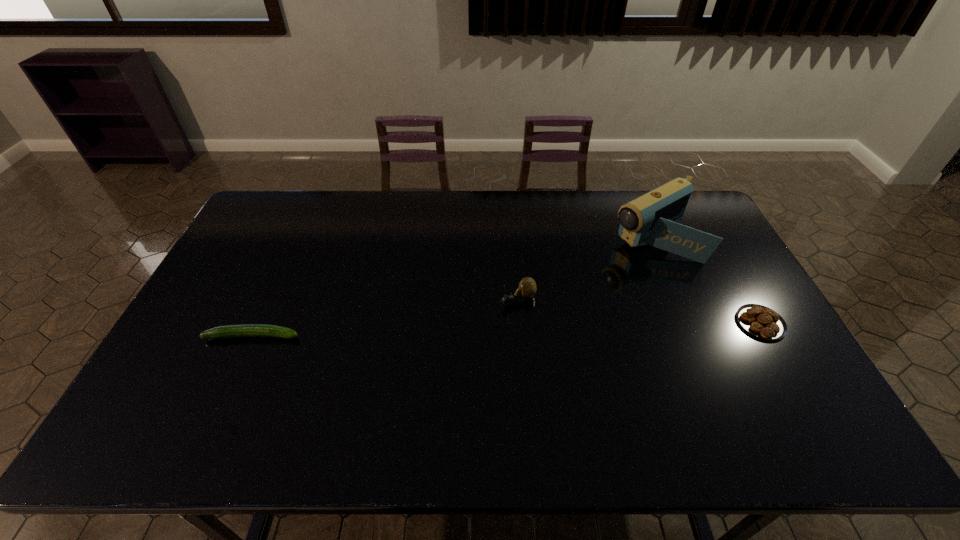
I want to click on the leftmost object, so click(x=246, y=330).

In order to click on pastry in this screenshot , I will do `click(761, 321)`.

At what (x,y) coordinates should I click in order to perform the action: click on the third object from right to left. Please return your answer as a coordinate pair (x, y). The height and width of the screenshot is (540, 960). Looking at the image, I should click on (527, 287).

Image resolution: width=960 pixels, height=540 pixels. What are the coordinates of `escargot` in the screenshot? It's located at (527, 287).

This screenshot has width=960, height=540. Find the location of `the farthest object`. the farthest object is located at coordinates (651, 219).

Identify the location of the tallest object. [x=651, y=219].

Where is `vacant space located on the front-facing side of the leftmost object`? Image resolution: width=960 pixels, height=540 pixels. vacant space located on the front-facing side of the leftmost object is located at coordinates (409, 336).

Locate an element on the screen. vacant space located 0.190m on the left of the pastry is located at coordinates pos(670,323).

This screenshot has width=960, height=540. Find the location of `free location located on the front-facing side of the third object from right to left`. free location located on the front-facing side of the third object from right to left is located at coordinates (467, 323).

In order to click on free space located 0.390m on the front-facing side of the third object from right to left in this screenshot , I will do `click(377, 367)`.